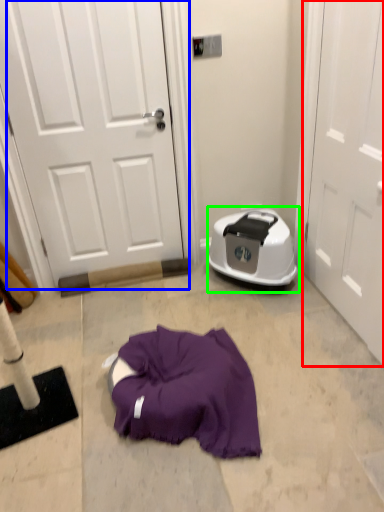
Question: Which object is positioned farthest from door (highlighted by a red box)? Select from door (highlighted by a blue box) and dish washer (highlighted by a green box).

Choices:
 (A) door
 (B) dish washer

Answer: (A)